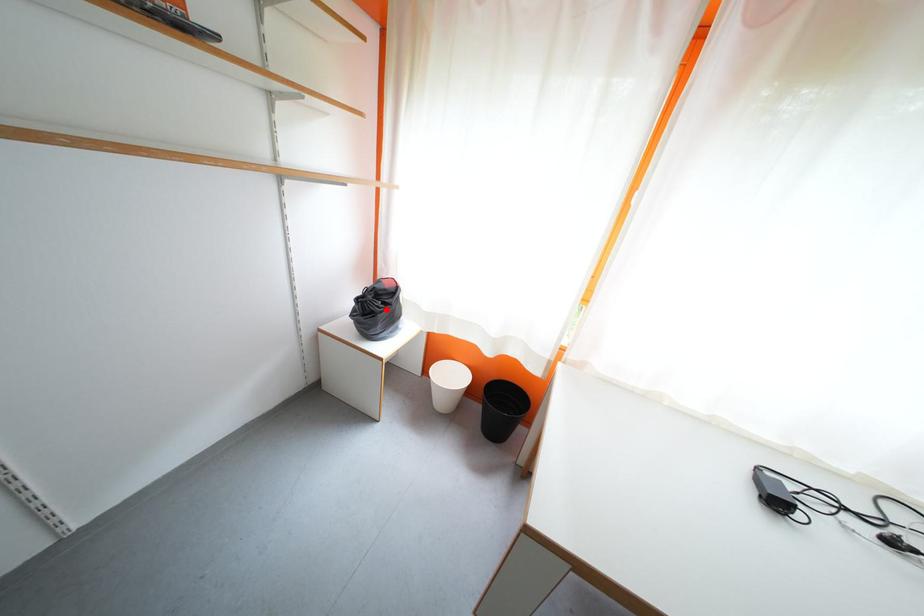
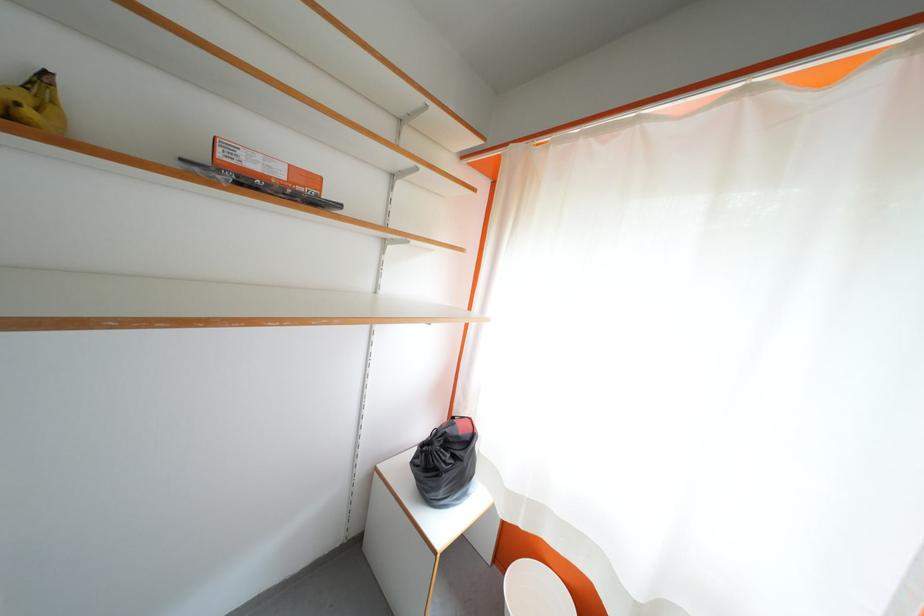
Question: A red point is marked in image1. In image2, is the corresponding 3D point closer to the camera or farther? Reply with the corresponding letter.

Choices:
 (A) The corresponding 3D point is closer.
 (B) The corresponding 3D point is farther.

Answer: (B)